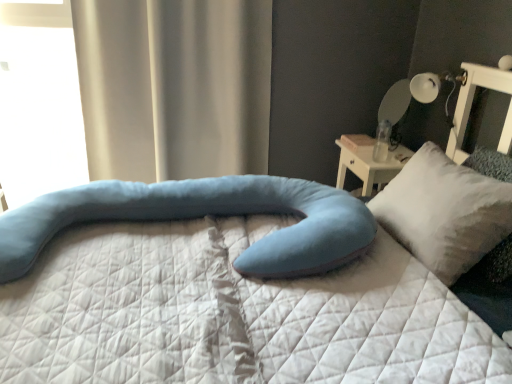
Question: From the image's perspective, is transparent glass window at upper left positioned above or below satin beige curtain at upper left?

Choices:
 (A) below
 (B) above

Answer: (B)

Question: Do you think transparent glass window at upper left is within satin beige curtain at upper left, or outside of it?

Choices:
 (A) outside
 (B) inside

Answer: (A)

Question: Estimate the real-world distances between objects in this image. Which object is closer to the soft blue fabric pillow at center, placed as the 2th pillow when sorted from right to left?

Choices:
 (A) transparent glass window at upper left
 (B) white soft pillow at right, arranged as the second pillow when viewed from the left
 (C) white glossy table lamp at upper right
 (D) satin beige curtain at upper left

Answer: (B)

Question: Considering the real-world distances, which object is closest to the satin beige curtain at upper left?

Choices:
 (A) transparent glass window at upper left
 (B) soft blue fabric pillow at center, marked as the 1th pillow in a left-to-right arrangement
 (C) white soft pillow at right, arranged as the second pillow when viewed from the left
 (D) white glossy table lamp at upper right

Answer: (B)